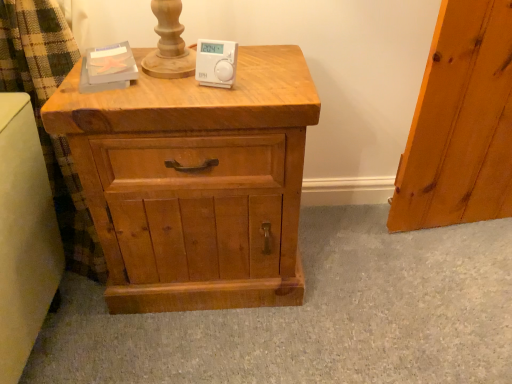
At what (x,y) coordinates should I click in order to perform the action: click on free space to the left of white plastic thermostat at center. Please return your answer as a coordinate pair (x, y). This screenshot has width=512, height=384. Looking at the image, I should click on (151, 79).